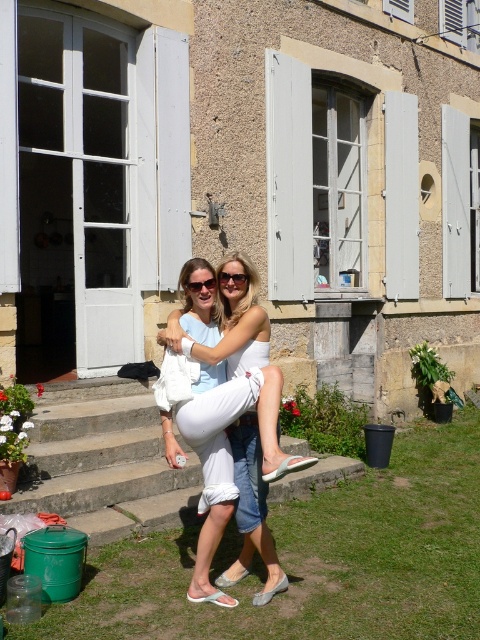
Question: Which point is farther from the camera taking this photo?

Choices:
 (A) (248, 275)
 (B) (260, 461)
 (C) (188, 288)

Answer: (B)

Question: Which object is farther from the camera taking this photo?

Choices:
 (A) white cotton shorts at center
 (B) matte white sunglasses at center
 (C) matte black sunglasses at center

Answer: (B)

Question: Does white cotton shorts at center appear under matte black sunglasses at center?

Choices:
 (A) yes
 (B) no

Answer: (A)

Question: Where is white cotton shorts at center located in relation to matte black sunglasses at center in the image?

Choices:
 (A) right
 (B) left

Answer: (A)

Question: Based on their relative distances, which object is nearer to the white cotton shorts at center?

Choices:
 (A) matte black sunglasses at center
 (B) matte white sunglasses at center

Answer: (B)

Question: Is white cotton shorts at center bigger than matte white sunglasses at center?

Choices:
 (A) no
 (B) yes

Answer: (B)